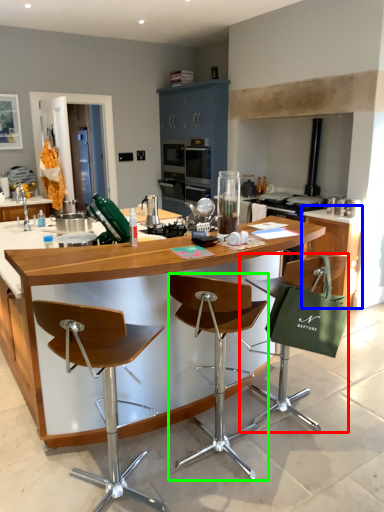
Question: Estimate the real-world distances between objects in this image. Which object is closer to chair (highlighted by a red box), cabinetry (highlighted by a blue box) or chair (highlighted by a green box)?

Choices:
 (A) cabinetry
 (B) chair

Answer: (B)